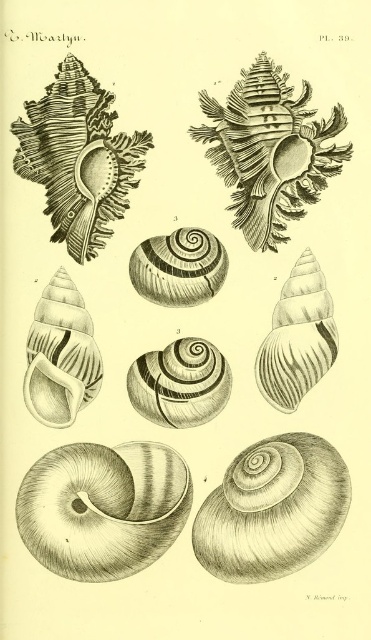
In the scene shown: Does smooth brown shell at upper center have a lesser width compared to smooth black shell at upper left?

No.

Looking at this image, is the position of smooth brown shell at upper center less distant than that of smooth black shell at upper left?

No, smooth brown shell at upper center is further to the viewer.

Between point (251, 236) and point (27, 154), which one is positioned in front?

Positioned in front is point (27, 154).

Locate an element on the screen. smooth brown shell at upper center is located at coordinates (270, 150).

Is smooth brown shell at bottom left smaller than smooth white shell at center right?

Actually, smooth brown shell at bottom left might be larger than smooth white shell at center right.

Does smooth brown shell at bottom left appear on the right side of smooth white shell at center right?

In fact, smooth brown shell at bottom left is to the left of smooth white shell at center right.

This screenshot has height=640, width=371. What do you see at coordinates (103, 508) in the screenshot? I see `smooth brown shell at bottom left` at bounding box center [103, 508].

The image size is (371, 640). Identify the location of smooth brown shell at bottom left. (103, 508).

The height and width of the screenshot is (640, 371). I want to click on smooth black shell at upper left, so click(79, 157).

Does point (107, 209) lie in front of point (208, 292)?

Yes, it is in front of point (208, 292).

Where is `smooth black shell at upper left`? Image resolution: width=371 pixels, height=640 pixels. smooth black shell at upper left is located at coordinates (79, 157).